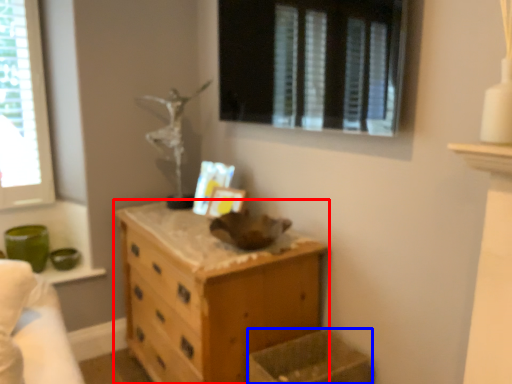
Question: Which object appears farthest to the camera in this image, chest of drawers (highlighted by a red box) or crate (highlighted by a blue box)?

Choices:
 (A) chest of drawers
 (B) crate

Answer: (A)